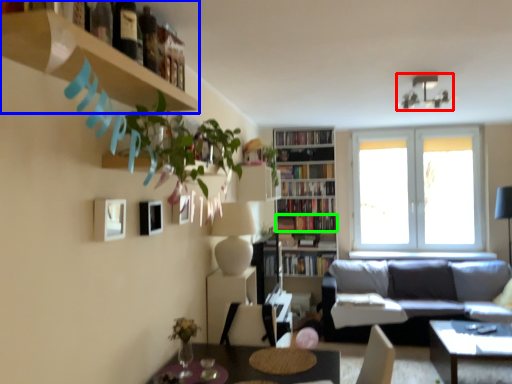
Question: Considering the real-world distances, which object is farthest from lamp (highlighted by a red box)? shelf (highlighted by a blue box) or book (highlighted by a green box)?

Choices:
 (A) shelf
 (B) book

Answer: (A)